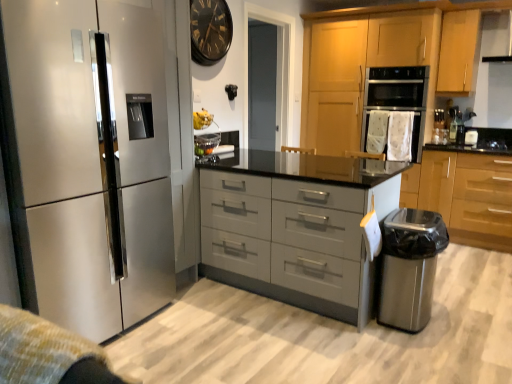
Question: From a real-world perspective, is satin grey drawers at center physically above black glass clock at upper center?

Choices:
 (A) no
 (B) yes

Answer: (A)

Question: Does satin grey drawers at center have a greater height compared to black glass clock at upper center?

Choices:
 (A) yes
 (B) no

Answer: (A)

Question: Is satin grey drawers at center shorter than black glass clock at upper center?

Choices:
 (A) yes
 (B) no

Answer: (B)

Question: Is satin grey drawers at center placed right next to black glass clock at upper center?

Choices:
 (A) yes
 (B) no

Answer: (B)

Question: From the image's perspective, is satin grey drawers at center under black glass clock at upper center?

Choices:
 (A) no
 (B) yes

Answer: (B)

Question: From the image's perspective, is black glass clock at upper center located above or below satin grey drawers at center?

Choices:
 (A) below
 (B) above

Answer: (B)

Question: Is black glass clock at upper center situated inside satin grey drawers at center or outside?

Choices:
 (A) outside
 (B) inside

Answer: (A)

Question: Considering the positions of black glass clock at upper center and satin grey drawers at center in the image, is black glass clock at upper center bigger or smaller than satin grey drawers at center?

Choices:
 (A) small
 (B) big

Answer: (A)

Question: From a real-world perspective, is black glass clock at upper center physically located above or below satin grey drawers at center?

Choices:
 (A) below
 (B) above

Answer: (B)

Question: From the image's perspective, is light wood/finished cabinet at upper right, which is the 2th cabinetry from right to left, positioned above or below satin wood cabinet at lower right, positioned as the first cabinetry in right-to-left order?

Choices:
 (A) above
 (B) below

Answer: (A)

Question: In terms of width, does light wood/finished cabinet at upper right, the second cabinetry from the left, look wider or thinner when compared to satin wood cabinet at lower right, the third cabinetry in the left-to-right sequence?

Choices:
 (A) wide
 (B) thin

Answer: (B)

Question: Considering their positions, is light wood/finished cabinet at upper right, the second cabinetry from the left, located in front of or behind satin wood cabinet at lower right, the third cabinetry in the left-to-right sequence?

Choices:
 (A) behind
 (B) front

Answer: (A)

Question: Is light wood/finished cabinet at upper right, which is the 2th cabinetry from right to left, taller or shorter than satin wood cabinet at lower right, the third cabinetry in the left-to-right sequence?

Choices:
 (A) tall
 (B) short

Answer: (B)

Question: In terms of width, does satin metallic refrigerator at left look wider or thinner when compared to satin grey drawers at center?

Choices:
 (A) wide
 (B) thin

Answer: (B)

Question: Considering the positions of point (44, 349) and point (226, 223), is point (44, 349) closer or farther from the camera than point (226, 223)?

Choices:
 (A) farther
 (B) closer

Answer: (B)